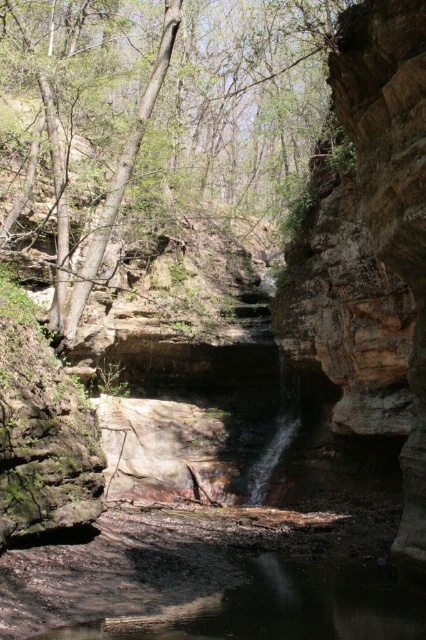
Question: Among these objects, which one is farthest from the camera?

Choices:
 (A) brown rough rock at center
 (B) clear water at center
 (C) brown rough tree at center

Answer: (C)

Question: Which object appears farthest from the camera in this image?

Choices:
 (A) brown rough rock at center
 (B) brown rough tree at center

Answer: (B)

Question: Does brown rough tree at center appear under clear water at center?

Choices:
 (A) no
 (B) yes

Answer: (A)

Question: Can you confirm if brown rough rock at center is positioned to the left of clear water at center?

Choices:
 (A) no
 (B) yes

Answer: (A)

Question: Can you confirm if brown rough tree at center is positioned below clear water at center?

Choices:
 (A) no
 (B) yes

Answer: (A)

Question: Which point is closer to the camera?

Choices:
 (A) (314, 595)
 (B) (371, 394)

Answer: (A)